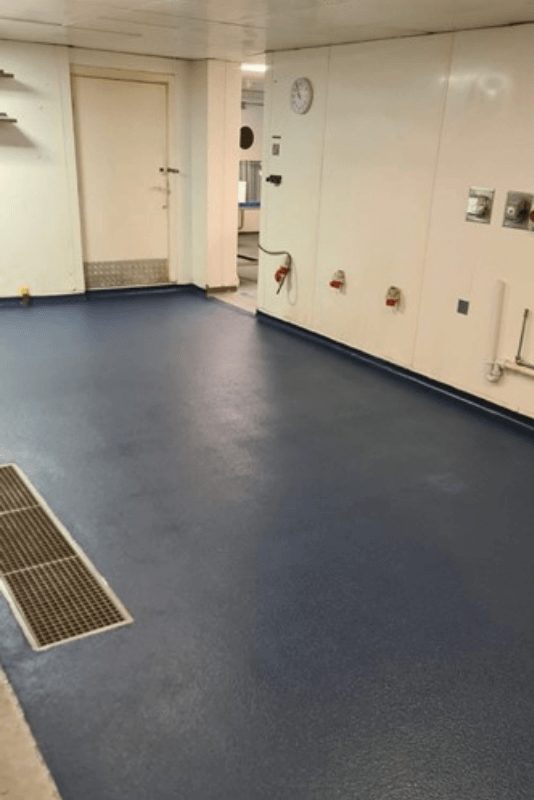
Image resolution: width=534 pixels, height=800 pixels. Identify the location of wall. (400, 357).